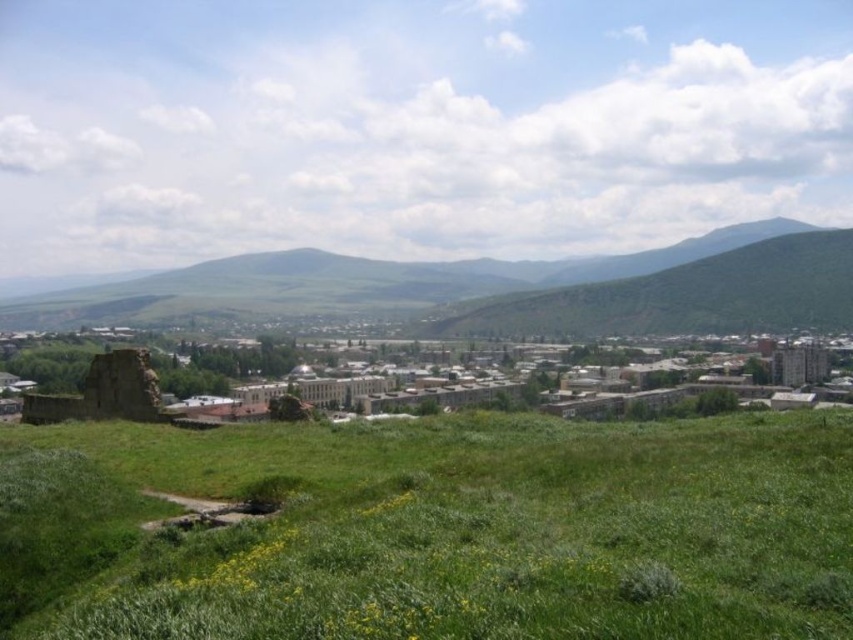
You are a hiker standing at the base of the hill. You want to take a photo of the rusty stone ruin at lower left while also including the green grassy field at lower center in the frame. Based on their heights, will you need to adjust your camera angle upwards or downwards to include both?

The green grassy field at lower center is not as tall as the rusty stone ruin at lower left. Therefore, to include both in the frame, you would need to tilt your camera upwards to capture the taller rusty stone ruin at lower left while still showing the shorter green grassy field at lower center.

Based on the photo, you are a hiker who wants to take a shortcut from the rusty stone ruin at lower left to the green grassy field at lower center. Which direction should you head towards?

The green grassy field at lower center is to the right of the rusty stone ruin at lower left, so you should head towards the right direction to reach it.

You are a drone operator trying to capture a photo of the town in the middle ground. You have two points marked on your screen for positioning the drone. The first point is at coordinates point (57, 305) and the second at point (41, 417). Which point should you choose to ensure the drone is closer to the town?

Point (41, 417) should be chosen because point (57, 305) is behind it, meaning the second point is closer to the town in the middle ground.